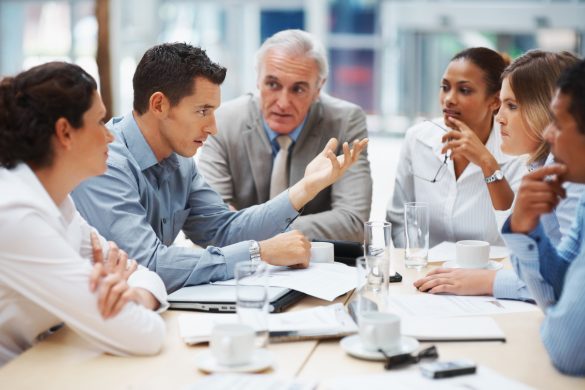
This screenshot has height=390, width=585. What are the coordinates of `papers` in the screenshot? It's located at (314, 322), (455, 319), (445, 249), (343, 281), (507, 305).